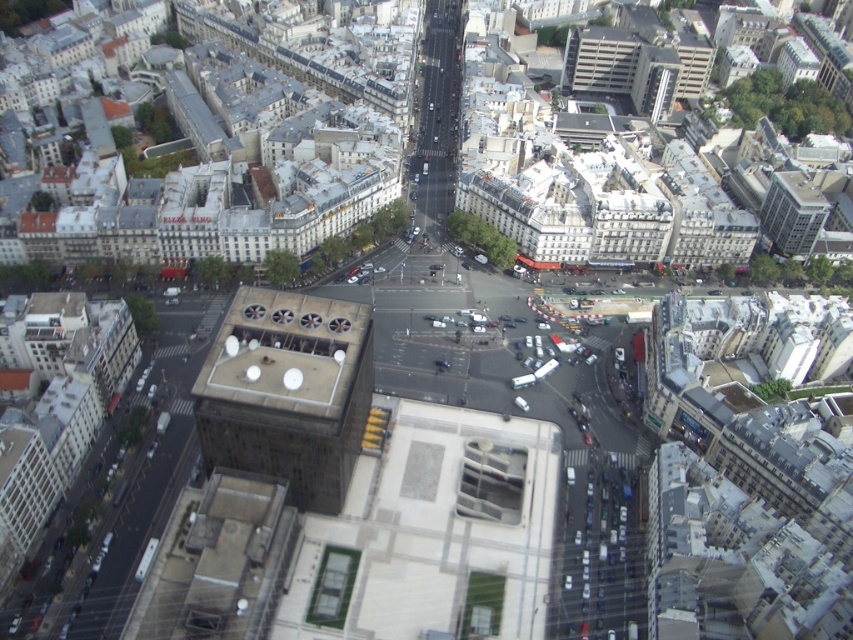
Can you confirm if dark gray concrete building at center is positioned to the right of glassy reflective skyscraper at upper right?

In fact, dark gray concrete building at center is to the left of glassy reflective skyscraper at upper right.

Does dark gray concrete building at center have a larger size compared to glassy reflective skyscraper at upper right?

Indeed, dark gray concrete building at center has a larger size compared to glassy reflective skyscraper at upper right.

The image size is (853, 640). What do you see at coordinates (287, 392) in the screenshot? I see `dark gray concrete building at center` at bounding box center [287, 392].

The image size is (853, 640). What are the coordinates of `dark gray concrete building at center` in the screenshot? It's located at (287, 392).